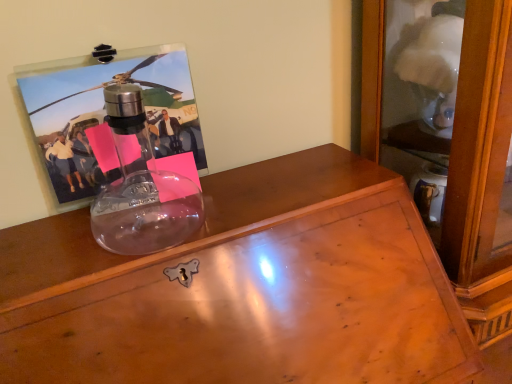
The image size is (512, 384). Identify the location of vacant area on top of transparent glass desk at upper left (from a real-world perspective). (170, 231).